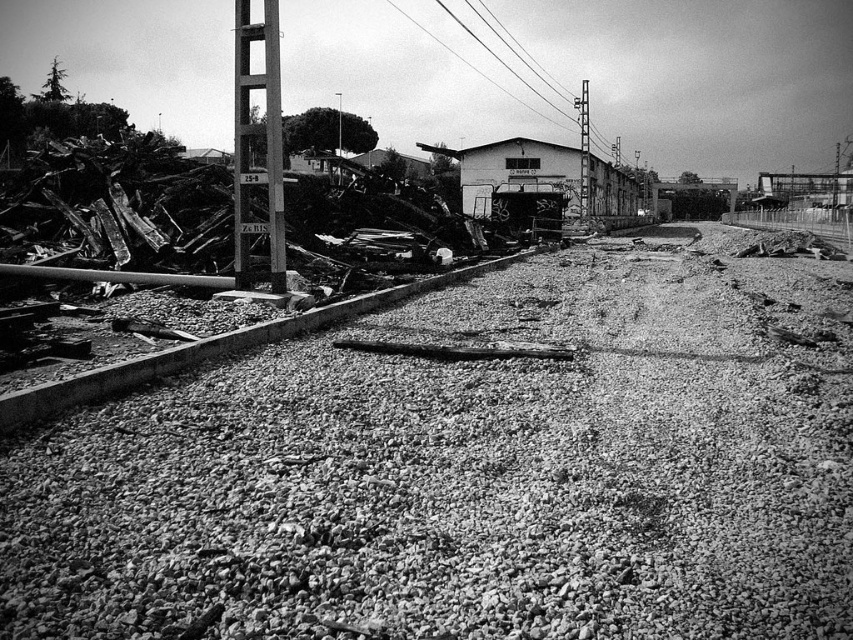
Is metallic gray pole at center-left to the right of smooth metal telegraph pole at center from the viewer's perspective?

No, metallic gray pole at center-left is not to the right of smooth metal telegraph pole at center.

Does metallic gray pole at center-left have a greater height compared to smooth metal telegraph pole at center?

Incorrect, metallic gray pole at center-left's height is not larger of smooth metal telegraph pole at center's.

Is point (235, 29) positioned in front of point (583, 152)?

Yes, it is in front of point (583, 152).

The image size is (853, 640). Identify the location of metallic gray pole at center-left. (264, 141).

Is point (221, 428) farther from viewer compared to point (585, 154)?

No.

Is point (693, 621) positioned after point (585, 179)?

No, (693, 621) is closer to viewer.

At what (x,y) coordinates should I click in order to perform the action: click on gravelly dirt track at center. Please return your answer as a coordinate pair (x, y). The height and width of the screenshot is (640, 853). Looking at the image, I should click on (471, 472).

Does gravelly dirt track at center have a lesser height compared to metallic gray pole at center-left?

Indeed, gravelly dirt track at center has a lesser height compared to metallic gray pole at center-left.

Is point (653, 440) closer to viewer compared to point (274, 116)?

Yes, it is in front of point (274, 116).

This screenshot has height=640, width=853. In order to click on gravelly dirt track at center in this screenshot , I will do `click(471, 472)`.

At what (x,y) coordinates should I click in order to perform the action: click on gravelly dirt track at center. Please return your answer as a coordinate pair (x, y). This screenshot has width=853, height=640. Looking at the image, I should click on (471, 472).